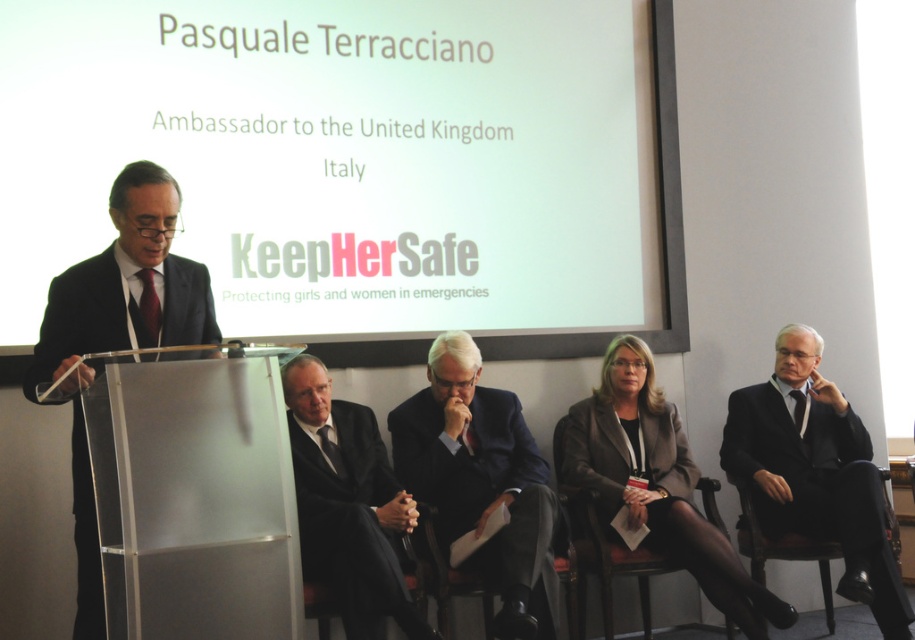
Is point (621, 451) closer to camera compared to point (402, 600)?

No, it is not.

Is matte gray blazer at center positioned behind black matte suit at center?

Yes, matte gray blazer at center is behind black matte suit at center.

Measure the distance between point (610, 424) and camera.

4.48 meters

Identify the location of matte gray blazer at center. This screenshot has width=915, height=640. (655, 483).

Who is positioned more to the right, black suit at right or matte gray blazer at center?

From the viewer's perspective, black suit at right appears more on the right side.

How distant is black suit at right from matte gray blazer at center?

black suit at right is 23.98 inches from matte gray blazer at center.

Image resolution: width=915 pixels, height=640 pixels. In order to click on black suit at right in this screenshot , I will do `click(816, 472)`.

Where is `black suit at right`? black suit at right is located at coordinates (816, 472).

Can you confirm if black suit at right is taller than dark blue fabric business suit at center?

Yes, black suit at right is taller than dark blue fabric business suit at center.

Can you confirm if black suit at right is shorter than dark blue fabric business suit at center?

Incorrect, black suit at right's height does not fall short of dark blue fabric business suit at center's.

Describe the element at coordinates (816, 472) in the screenshot. This screenshot has height=640, width=915. I see `black suit at right` at that location.

At what (x,y) coordinates should I click in order to perform the action: click on black suit at right. Please return your answer as a coordinate pair (x, y). Looking at the image, I should click on (816, 472).